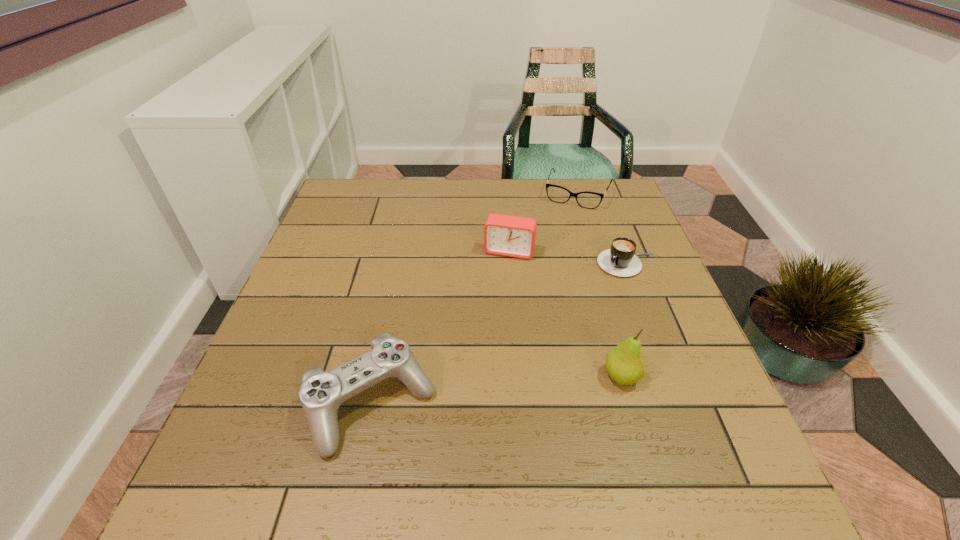
In the image, there is a desktop. Identify the location of vacant space at the far right corner. (601, 214).

Identify the location of vacant area at the near right corner. (675, 436).

Identify the location of free spot between the second tallest object and the cappuccino. (568, 258).

You are a GUI agent. You are given a task and a screenshot of the screen. Output one action in this format:
    pyautogui.click(x=<x>, y=<y>)
    Task: Click on the free spot between the fourth object from right to left and the control
    Image resolution: width=960 pixels, height=540 pixels.
    Given the screenshot: What is the action you would take?
    pyautogui.click(x=441, y=328)

I want to click on vacant region between the farthest object and the pear, so click(599, 285).

This screenshot has height=540, width=960. Identify the location of vacant space that's between the second tallest object and the cappuccino. (568, 258).

Find the location of a particular element. The height and width of the screenshot is (540, 960). vacant area between the cappuccino and the second object from left to right is located at coordinates (568, 258).

Locate an element on the screen. free area in between the cappuccino and the tallest object is located at coordinates (624, 320).

Where is `free point between the fourth object from right to left and the pear`? This screenshot has height=540, width=960. free point between the fourth object from right to left and the pear is located at coordinates (564, 314).

Locate an element on the screen. This screenshot has width=960, height=540. vacant area between the cappuccino and the second object from left to right is located at coordinates (568, 258).